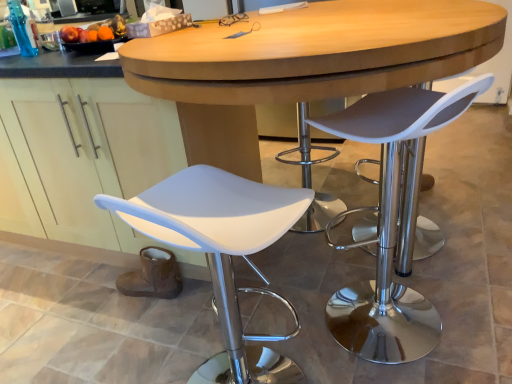
Identify the location of blank space to the left of matte gray seat at right, placed as the second chair when sorted from left to right. The height and width of the screenshot is (384, 512). (292, 321).